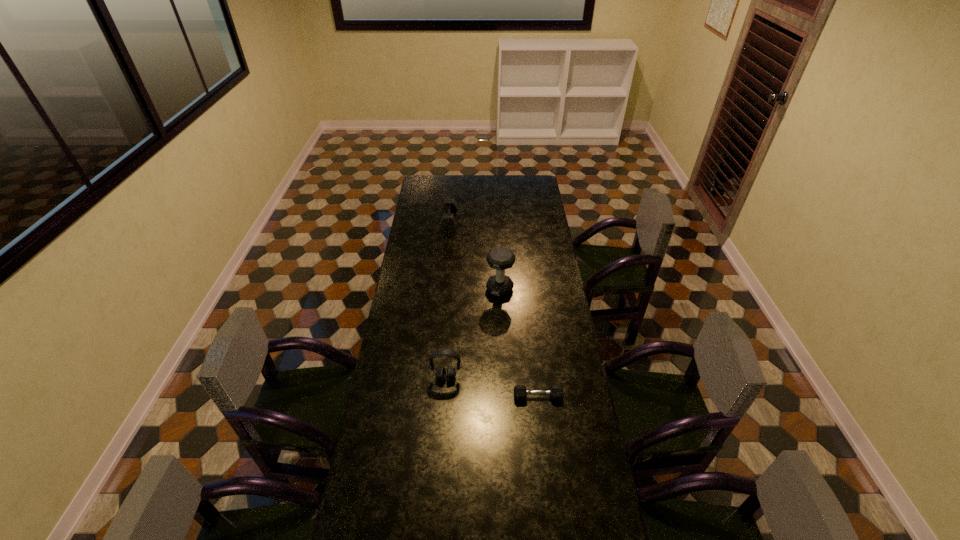
This screenshot has height=540, width=960. I want to click on the second nearest dumbbell, so click(x=500, y=258).

Identify the location of the tallest dumbbell. This screenshot has height=540, width=960. (500, 258).

Locate an element on the screen. The width and height of the screenshot is (960, 540). headset is located at coordinates (440, 374).

Where is `the third farthest object`? The image size is (960, 540). the third farthest object is located at coordinates [440, 374].

This screenshot has width=960, height=540. In order to click on the second shortest dumbbell in this screenshot , I will do `click(447, 222)`.

In order to click on the farthest object in this screenshot , I will do `click(447, 222)`.

Locate an element on the screen. the nearest object is located at coordinates (556, 392).

At what (x,y) coordinates should I click in order to perform the action: click on the nearest dumbbell. Please return your answer as a coordinate pair (x, y). Looking at the image, I should click on (556, 392).

The width and height of the screenshot is (960, 540). Identify the location of free space located on the back of the second nearest dumbbell. (497, 248).

The height and width of the screenshot is (540, 960). I want to click on free region located 0.130m on the front-facing side of the second nearest object, so click(x=444, y=414).